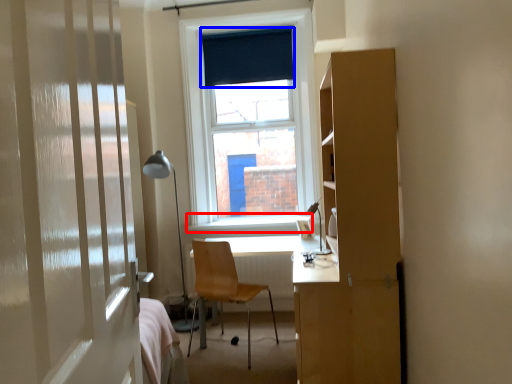
Question: Which object appears farthest to the camera in this image, window sill (highlighted by a red box) or curtain (highlighted by a blue box)?

Choices:
 (A) window sill
 (B) curtain

Answer: (B)